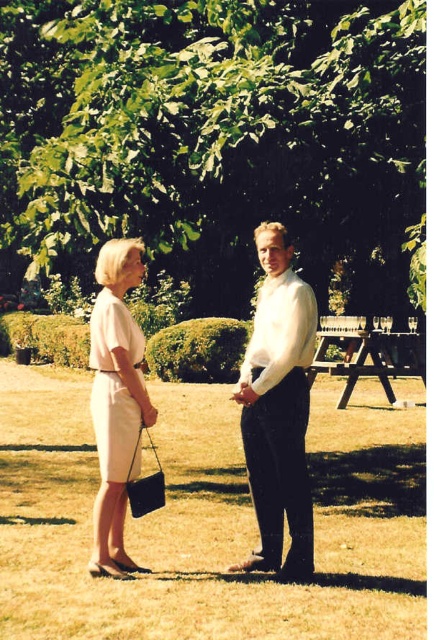
Question: Among these points, which one is farthest from the camera?

Choices:
 (A) (302, 458)
 (B) (388, 605)
 (C) (121, 563)
 (D) (273, 244)

Answer: (C)

Question: Which object appears closest to the camera in this image?

Choices:
 (A) green grass at center
 (B) matte white dress at center

Answer: (A)

Question: Among these points, which one is nearest to the camera?

Choices:
 (A) (280, 349)
 (B) (115, 372)
 (C) (282, 29)
 (D) (292, 308)

Answer: (A)

Question: Does green grass at center have a larger size compared to white smooth shirt at center?

Choices:
 (A) yes
 (B) no

Answer: (A)

Question: Is green grass at center to the left of matte white dress at center from the viewer's perspective?

Choices:
 (A) no
 (B) yes

Answer: (A)

Question: Can you confirm if green grass at center is thinner than light beige fabric dress at center?

Choices:
 (A) no
 (B) yes

Answer: (A)